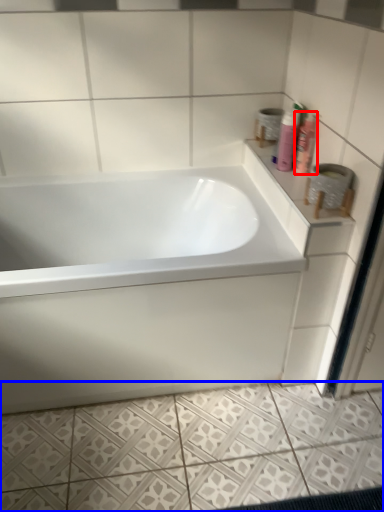
Question: Which object appears closest to the camera in this image, shaving cream (highlighted by a red box) or ceramic tile (highlighted by a blue box)?

Choices:
 (A) shaving cream
 (B) ceramic tile

Answer: (B)